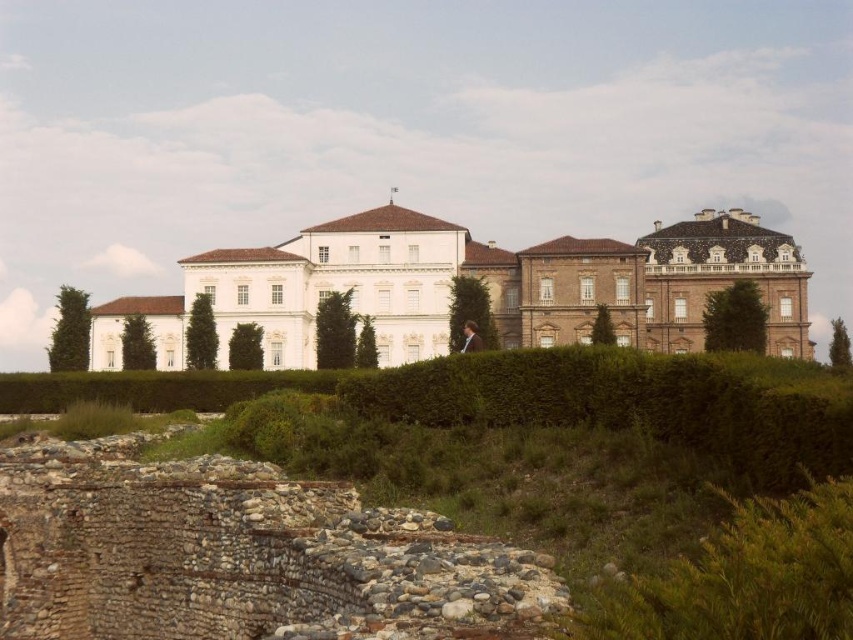
Looking at this image, you are a photographer planning to capture the white smooth mansion at center and the brown fuzzy coat at center in a single shot. Given that the camera can only accommodate objects within a 10m width, will both objects fit within the frame?

The white smooth mansion at center is wider than the brown fuzzy coat at center. Since the mansion is wider, it might exceed the 10m width capacity of the camera frame. However, without knowing the exact widths of both objects, we can only conclude that the mansion is wider, so it depends on the mansion being under 10m. But according to the description, the mansion surpasses the coat in width, but without specific measurements, we can only state that the mansion is wider. Therefore, if the mansion is within